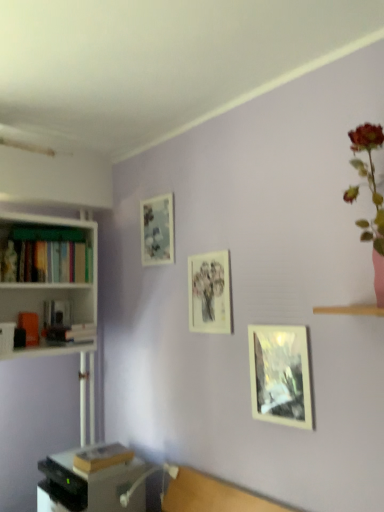
Question: Can you confirm if matte paper picture frame at center, the second picture frame in the left-to-right sequence, is bigger than matte glass picture frame at upper left, positioned as the 1th picture frame in top-to-bottom order?

Choices:
 (A) no
 (B) yes

Answer: (A)

Question: From the image's perspective, is matte paper picture frame at center, marked as the 2th picture frame in a back-to-front arrangement, on matte glass picture frame at upper left, positioned as the third picture frame in front-to-back order?

Choices:
 (A) no
 (B) yes

Answer: (A)

Question: Considering the relative sizes of matte paper picture frame at center, arranged as the second picture frame when viewed from the top, and matte glass picture frame at upper left, which is the 1th picture frame in left-to-right order, in the image provided, is matte paper picture frame at center, arranged as the second picture frame when viewed from the top, shorter than matte glass picture frame at upper left, which is the 1th picture frame in left-to-right order,?

Choices:
 (A) yes
 (B) no

Answer: (B)

Question: Is matte paper picture frame at center, the second picture frame in the left-to-right sequence, beside matte glass picture frame at upper left, which is the 1th picture frame in left-to-right order?

Choices:
 (A) no
 (B) yes

Answer: (A)

Question: From a real-world perspective, is matte paper picture frame at center, the second picture frame in the left-to-right sequence, on matte glass picture frame at upper left, positioned as the 1th picture frame in top-to-bottom order?

Choices:
 (A) no
 (B) yes

Answer: (A)

Question: From a real-world perspective, is hardcover book at left, acting as the second book starting from the bottom, physically located above or below metallic gray desk at lower left?

Choices:
 (A) above
 (B) below

Answer: (A)

Question: Is point (86, 336) closer or farther from the camera than point (152, 502)?

Choices:
 (A) farther
 (B) closer

Answer: (A)

Question: Would you say hardcover book at left, acting as the second book starting from the bottom, is to the left or to the right of metallic gray desk at lower left in the picture?

Choices:
 (A) right
 (B) left

Answer: (B)

Question: Considering their positions, is hardcover book at left, acting as the 2th book starting from the top, located in front of or behind metallic gray desk at lower left?

Choices:
 (A) behind
 (B) front

Answer: (A)

Question: Is matte glass picture frame at upper left, which is the 1th picture frame in left-to-right order, in front of or behind hardcover books at left, positioned as the third book in bottom-to-top order, in the image?

Choices:
 (A) front
 (B) behind

Answer: (B)

Question: Would you say matte glass picture frame at upper left, positioned as the 1th picture frame in top-to-bottom order, is to the left or to the right of hardcover books at left, positioned as the third book in bottom-to-top order, in the picture?

Choices:
 (A) left
 (B) right

Answer: (B)

Question: Is point (160, 250) positioned closer to the camera than point (34, 256)?

Choices:
 (A) closer
 (B) farther

Answer: (B)

Question: Looking at the image, does matte glass picture frame at upper left, arranged as the first picture frame when viewed from the back, seem bigger or smaller compared to hardcover books at left, positioned as the third book in bottom-to-top order?

Choices:
 (A) big
 (B) small

Answer: (B)

Question: Is point (82, 466) positioned closer to the camera than point (94, 329)?

Choices:
 (A) farther
 (B) closer

Answer: (B)

Question: Considering their positions, is hardcover book at lower left, the 3th book positioned from the top, located in front of or behind hardcover book at left, acting as the 2th book starting from the top?

Choices:
 (A) front
 (B) behind

Answer: (A)